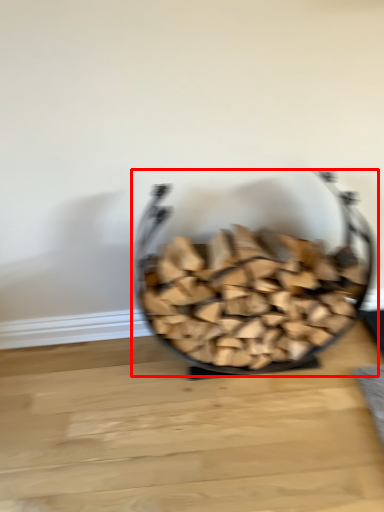
Question: From the image, what is the correct spatial relationship of tableware (annotated by the red box) in relation to table top?

Choices:
 (A) left
 (B) right

Answer: (B)